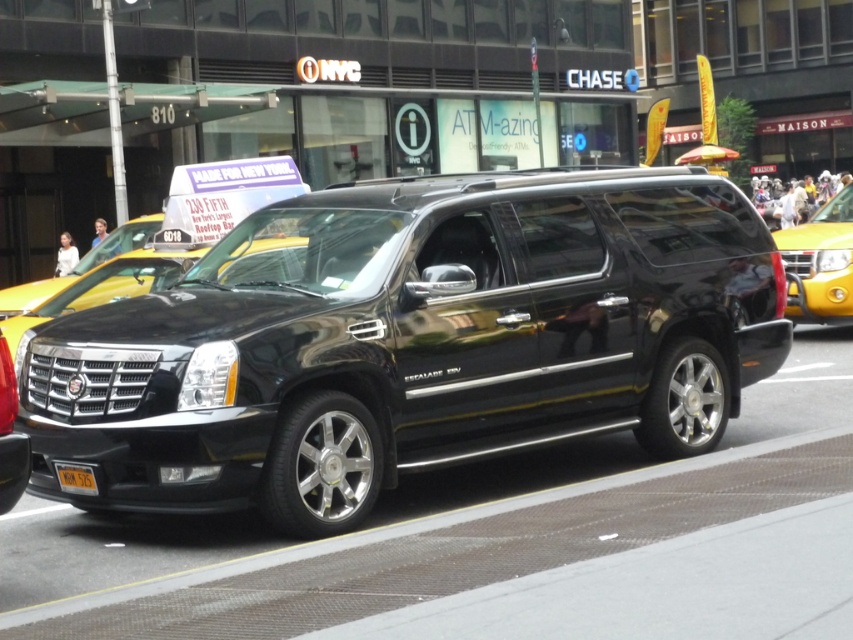
Can you confirm if shiny black minivan at center is positioned to the left of yellow matte license plate at center?

No, shiny black minivan at center is not to the left of yellow matte license plate at center.

Is shiny black minivan at center closer to the viewer compared to yellow matte license plate at center?

Yes, shiny black minivan at center is in front of yellow matte license plate at center.

Between point (264, 445) and point (80, 468), which one is positioned behind?

Point (80, 468)

The width and height of the screenshot is (853, 640). I want to click on shiny black minivan at center, so click(x=410, y=340).

Based on the photo, does shiny black minivan at center have a greater width compared to yellow matte taxi at center?

Correct, the width of shiny black minivan at center exceeds that of yellow matte taxi at center.

The width and height of the screenshot is (853, 640). I want to click on shiny black minivan at center, so click(x=410, y=340).

Find the location of a particular element. The image size is (853, 640). yellow matte taxi at center is located at coordinates (106, 285).

Is yellow matte taxi at center positioned in front of yellow matte license plate at center?

No, yellow matte taxi at center is further to the viewer.

Which is in front, point (56, 307) or point (84, 483)?

Point (84, 483) is more forward.

You are a GUI agent. You are given a task and a screenshot of the screen. Output one action in this format:
    pyautogui.click(x=<x>, y=<y>)
    Task: Click on the yellow matte taxi at center
    Image resolution: width=853 pixels, height=640 pixels.
    Given the screenshot: What is the action you would take?
    pyautogui.click(x=106, y=285)